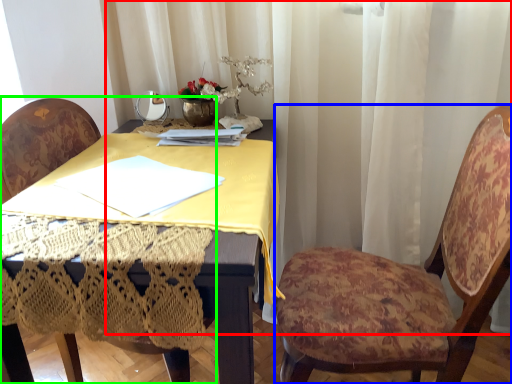
Question: Estimate the real-world distances between objects in this image. Which object is farther from curtain (highlighted by a red box), chair (highlighted by a blue box) or chair (highlighted by a green box)?

Choices:
 (A) chair
 (B) chair

Answer: (B)